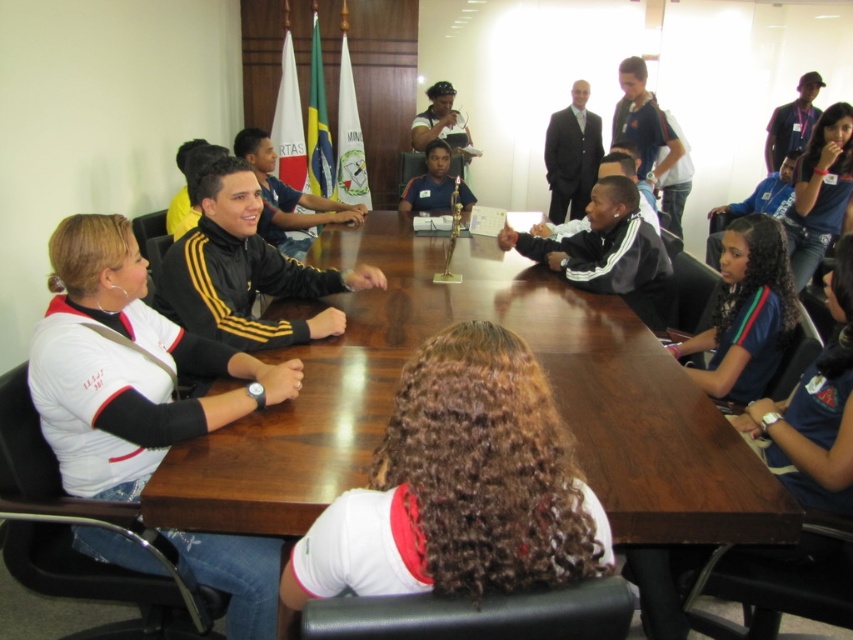
Question: Can you confirm if wooden table at center is bigger than dark blue jersey at upper right?

Choices:
 (A) no
 (B) yes

Answer: (B)

Question: Is dark gray suit at center to the left of matte blue shirt at center from the viewer's perspective?

Choices:
 (A) no
 (B) yes

Answer: (A)

Question: Which point is farther from the camera taking this photo?

Choices:
 (A) (804, 157)
 (B) (728, 339)
 (C) (431, 573)
 (D) (189, 371)

Answer: (A)

Question: Which point is closer to the camera?

Choices:
 (A) wooden table at center
 (B) white jersey at left
 (C) matte black cap at upper center

Answer: (A)

Question: Is matte black cap at upper center smaller than dark blue jacket at upper right?

Choices:
 (A) no
 (B) yes

Answer: (A)

Question: Estimate the real-world distances between objects in this image. Which object is closer to the black matte jacket at upper left?

Choices:
 (A) dark blue jacket at upper right
 (B) matte blue shirt at center
 (C) matte black cap at upper center
 (D) wooden table at center

Answer: (B)